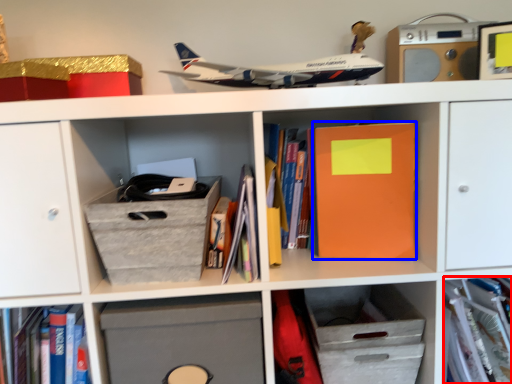
Question: Which object appears farthest to the camera in this image, book (highlighted by a red box) or paperback book (highlighted by a blue box)?

Choices:
 (A) book
 (B) paperback book

Answer: (A)